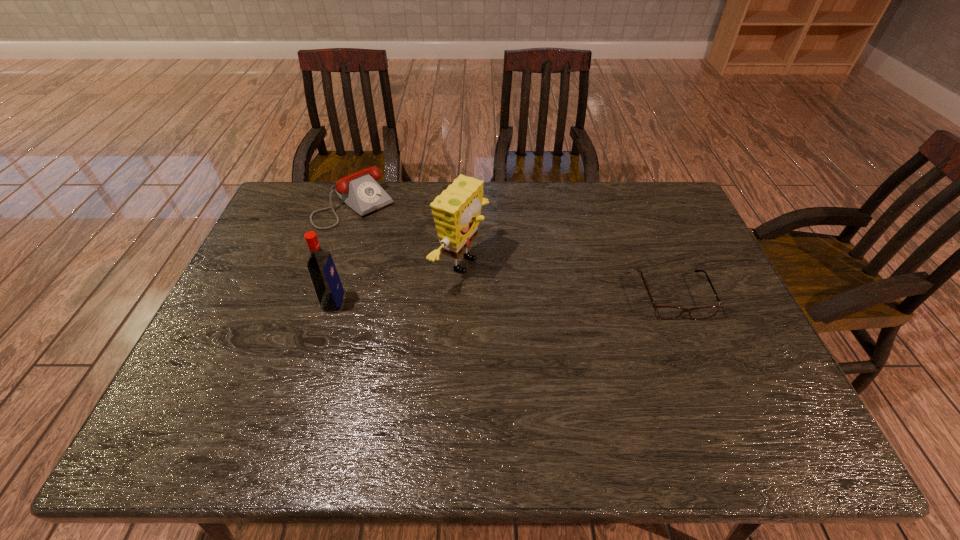
Locate an element on the screen. vacant region at the far edge of the desktop is located at coordinates (411, 191).

Where is `vacant space at the near edge`? The image size is (960, 540). vacant space at the near edge is located at coordinates (566, 400).

In the image, there is a desktop. Find the location of `blank space at the left edge`. blank space at the left edge is located at coordinates tap(302, 252).

Where is `free spot at the far left corner of the desktop`? free spot at the far left corner of the desktop is located at coordinates (301, 219).

At what (x,y) coordinates should I click in order to perform the action: click on unoccupied area between the sponge and the spectacles. Please return your answer as a coordinate pair (x, y). The image size is (960, 540). Looking at the image, I should click on (567, 280).

Find the location of a particular element. The image size is (960, 540). vacant point located between the sponge and the spectacles is located at coordinates (567, 280).

Find the location of a particular element. vacant area that lies between the sponge and the farthest object is located at coordinates click(x=408, y=234).

Identify the location of unoccupied position between the telephone and the vodka. This screenshot has width=960, height=540. (345, 253).

The image size is (960, 540). In order to click on free space between the spectacles and the vodka in this screenshot , I will do `click(504, 299)`.

You are a GUI agent. You are given a task and a screenshot of the screen. Output one action in this format:
    pyautogui.click(x=<x>, y=<y>)
    Task: Click on the vacant area that lies between the farthest object and the sponge
    
    Given the screenshot: What is the action you would take?
    pyautogui.click(x=408, y=234)